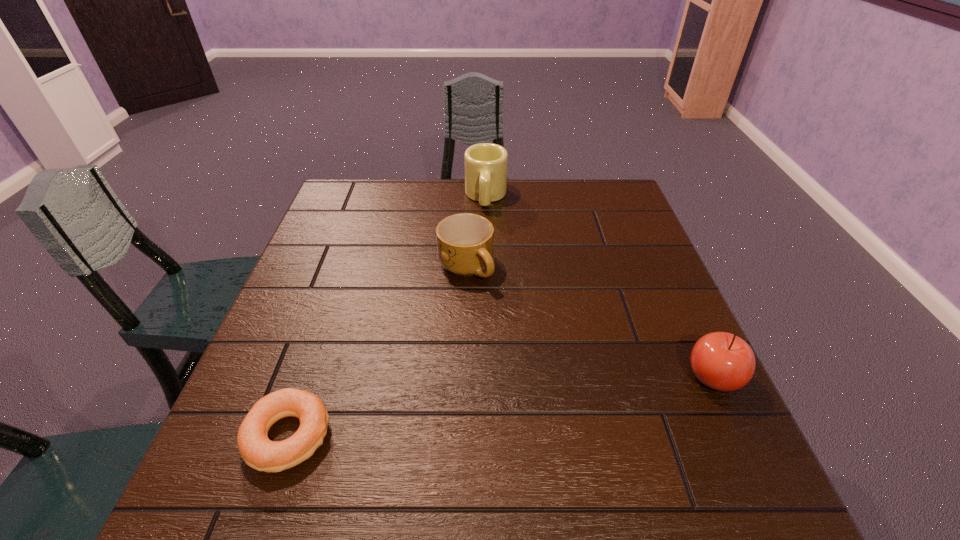
What are the coordinates of `vacant space located on the side with the handle of the second shortest object` in the screenshot? It's located at (540, 405).

Identify the location of free spot located 0.160m on the side with the handle of the second shortest object. The width and height of the screenshot is (960, 540). (502, 337).

Locate an element on the screen. blank space located 0.080m with the handle on the side of the taller mug is located at coordinates (485, 230).

Identify the location of vacant region located 0.360m with the handle on the side of the taller mug. This screenshot has height=540, width=960. (481, 299).

Find the location of a particular element. The width and height of the screenshot is (960, 540). free space located with the handle on the side of the taller mug is located at coordinates (481, 296).

The height and width of the screenshot is (540, 960). In order to click on object at the far edge in this screenshot , I will do `click(486, 164)`.

Identify the location of object that is at the near edge. (258, 451).

You are a GUI agent. You are given a task and a screenshot of the screen. Output one action in this format:
    pyautogui.click(x=<x>, y=<y>)
    Task: Click on the object positioned at the left edge
    The height and width of the screenshot is (540, 960).
    Given the screenshot: What is the action you would take?
    pyautogui.click(x=258, y=451)

Find the location of a particular element. This screenshot has height=540, width=960. object that is at the right edge is located at coordinates click(722, 361).

Locate an element on the screen. object located in the near left corner section of the desktop is located at coordinates (258, 451).